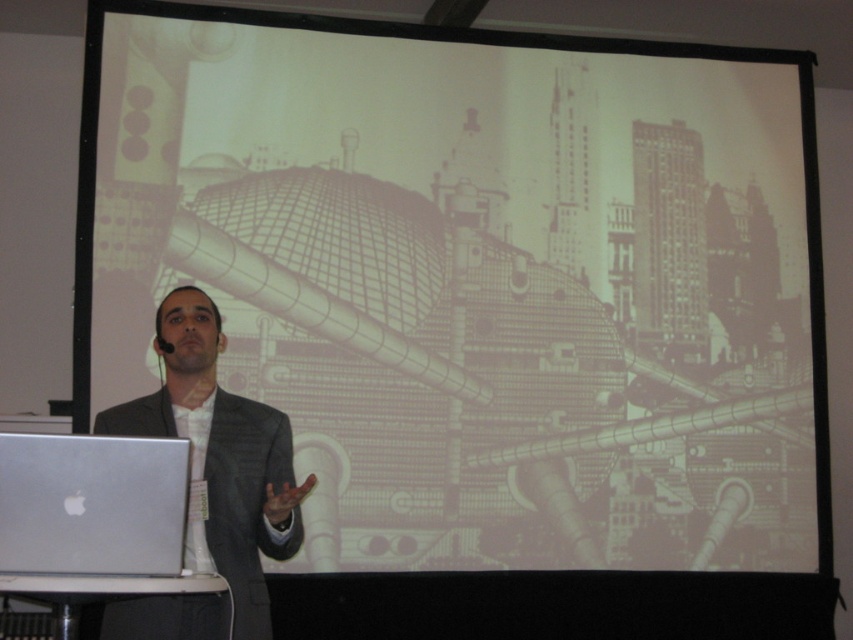
Question: Which of the following is the closest to the observer?

Choices:
 (A) (250, 604)
 (B) (111, 538)

Answer: (B)

Question: Does dark gray suit at center appear over silver metallic laptop at lower left?

Choices:
 (A) yes
 (B) no

Answer: (A)

Question: Where is dark gray suit at center located in relation to silver metallic laptop at lower left in the image?

Choices:
 (A) left
 (B) right

Answer: (B)

Question: Can you confirm if dark gray suit at center is positioned above silver metallic laptop at lower left?

Choices:
 (A) yes
 (B) no

Answer: (A)

Question: Among these objects, which one is nearest to the camera?

Choices:
 (A) silver metallic laptop at lower left
 (B) dark gray suit at center

Answer: (A)

Question: Among these points, which one is farthest from the camera?

Choices:
 (A) (132, 561)
 (B) (219, 412)

Answer: (B)